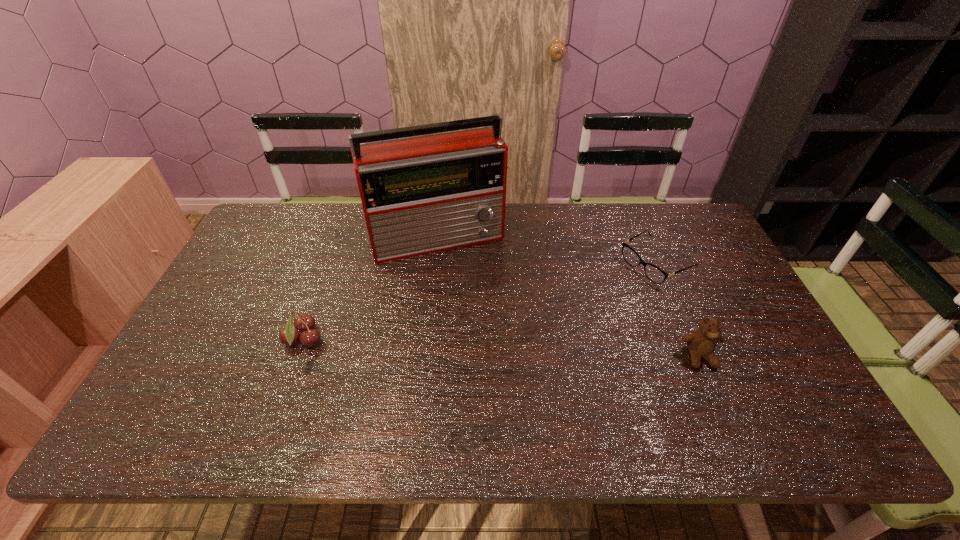
What are the coordinates of `vacant area at the near edge` in the screenshot? It's located at (691, 373).

Locate an element on the screen. vacant space at the left edge is located at coordinates (247, 263).

The image size is (960, 540). I want to click on free space at the right edge of the desktop, so click(x=695, y=298).

Identify the location of vacant area at the far left corner. (283, 210).

Where is `free space at the near left corner of the desktop`? The height and width of the screenshot is (540, 960). free space at the near left corner of the desktop is located at coordinates (174, 374).

Find the location of a particular element. The image size is (960, 540). vacant region between the cherry and the spectacles is located at coordinates (480, 302).

Locate an element on the screen. This screenshot has width=960, height=540. unoccupied position between the third object from right to left and the third shortest object is located at coordinates (569, 297).

I want to click on vacant area between the radio receiver and the leftmost object, so click(x=372, y=289).

The height and width of the screenshot is (540, 960). I want to click on free space between the radio receiver and the second tallest object, so click(569, 297).

Where is `vacant space that's between the spectacles and the teddy bear`? This screenshot has height=540, width=960. vacant space that's between the spectacles and the teddy bear is located at coordinates (678, 310).